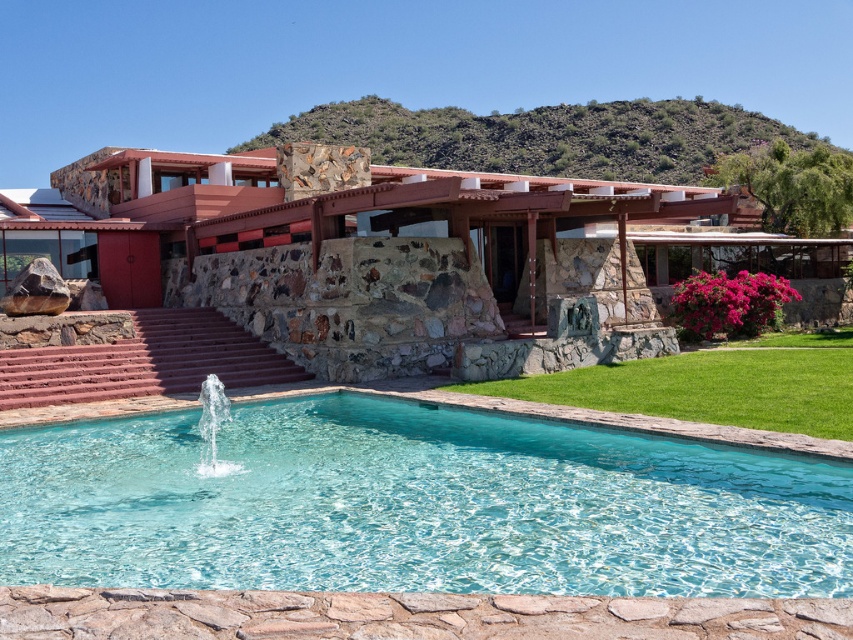
You are standing at the entrance of the rustic stone villa at center. If you walk straight ahead, will you immediately see the fountain in the pool?

The fountain is located within the pool, which is in the foreground of the scene. Since the rustic stone villa at center is positioned centrally and the fountain is in the foreground, walking straight ahead from the entrance would likely lead towards the pool area where the fountain is situated. Therefore, yes, you would see the fountain as you move forward.

You are a visitor standing in front of the clear glass pool at center and the rustic stone villa at center. Which structure appears taller from your perspective?

The rustic stone villa at center appears taller than the clear glass pool at center because the clear glass pool at center is not as tall as rustic stone villa at center.